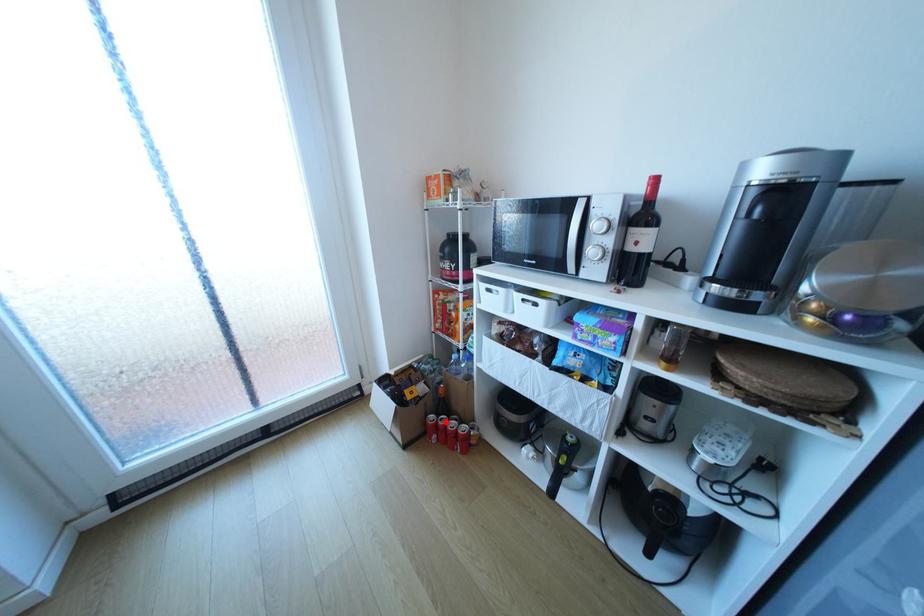
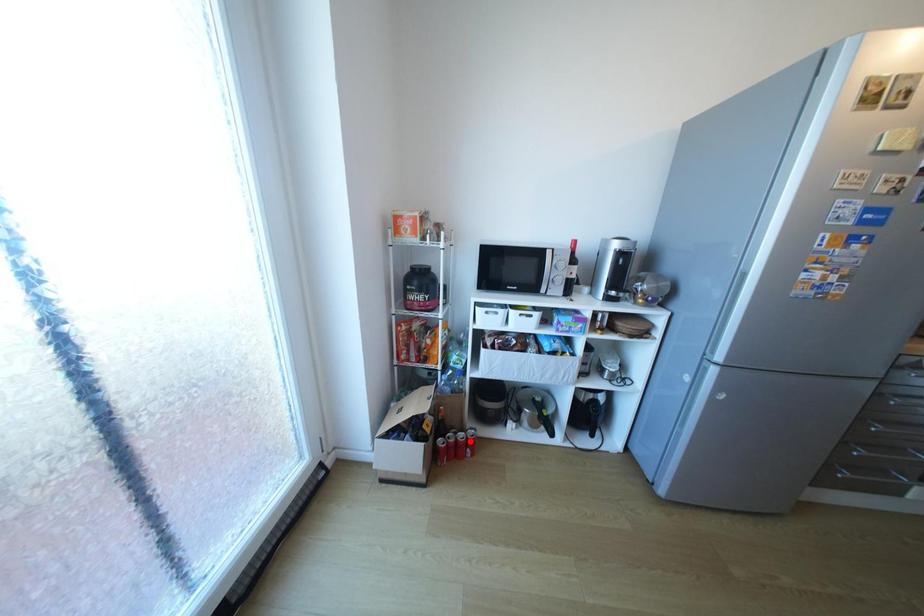
I am providing you with two images of the same scene from different viewpoints. A red point is marked on the first image and another point is marked on the second image. Are the points marked in image1 and image2 representing the same 3D position?

No